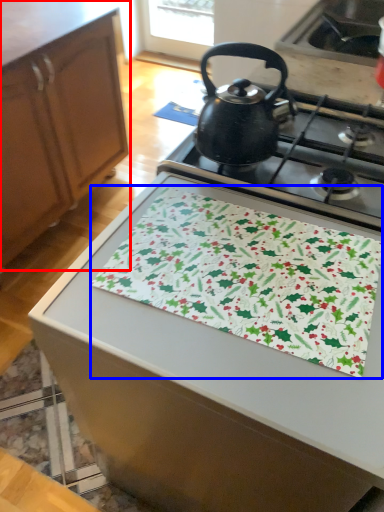
Question: Which point is further to the camera, cabinetry (highlighted by a red box) or blanket (highlighted by a blue box)?

Choices:
 (A) cabinetry
 (B) blanket

Answer: (A)